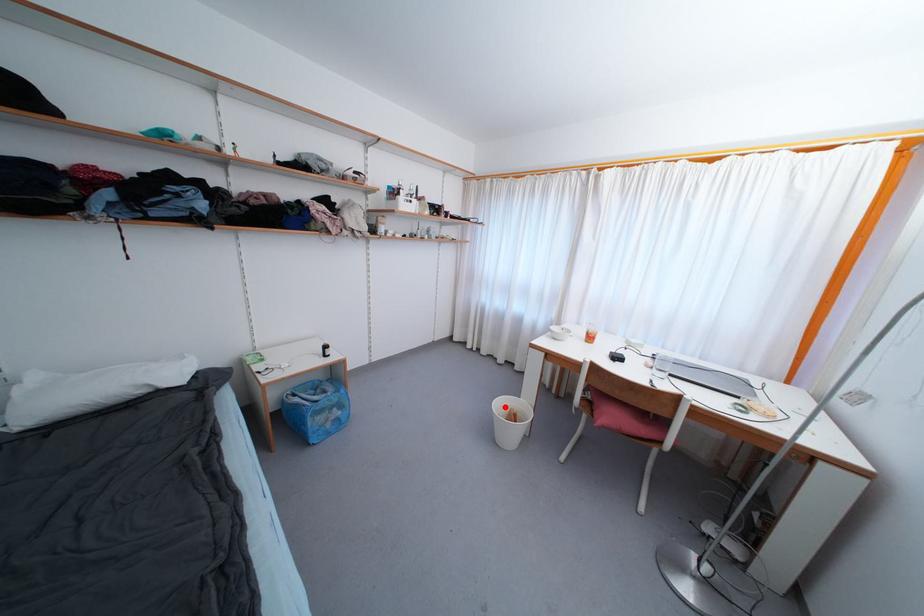
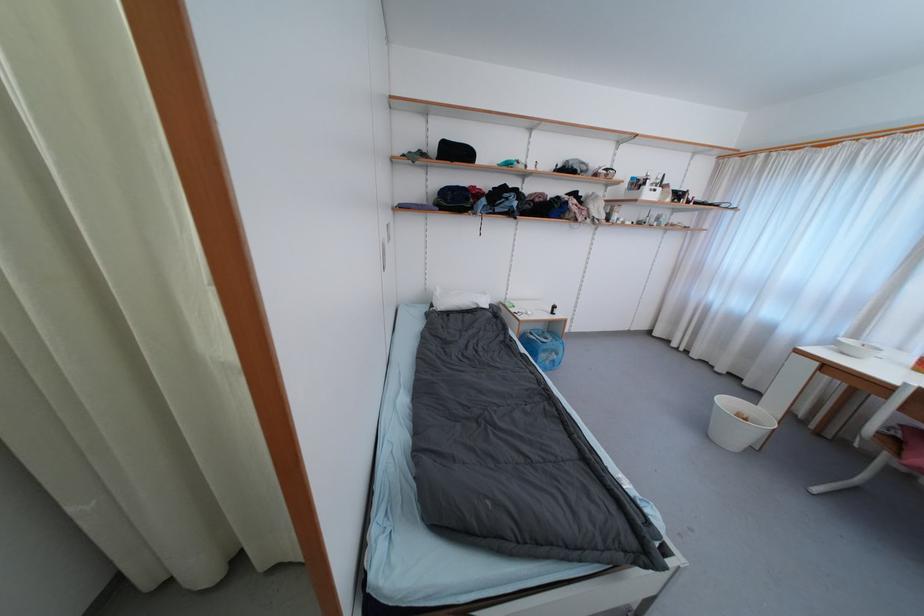
Where in the second image is the point corresponding to the highlighted location from the first image?

(732, 405)